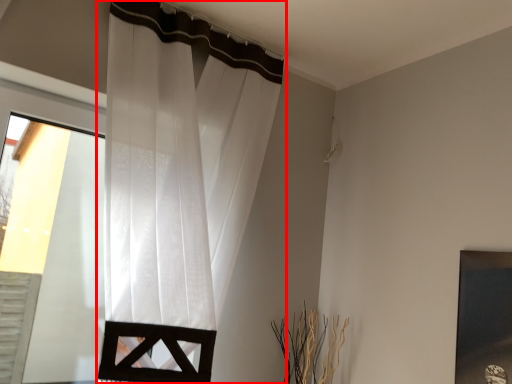
Question: From the image's perspective, what is the correct spatial relationship of curtain (annotated by the red box) in relation to picture frame?

Choices:
 (A) above
 (B) below

Answer: (A)